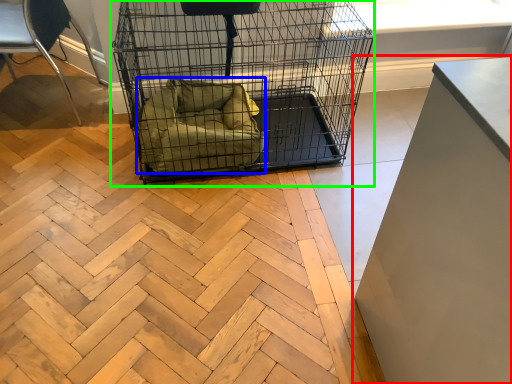
Question: Which object is positioned farthest from furniture (highlighted by a red box)? Select from dog bed (highlighted by a blue box) and bird cage (highlighted by a green box).

Choices:
 (A) dog bed
 (B) bird cage

Answer: (B)